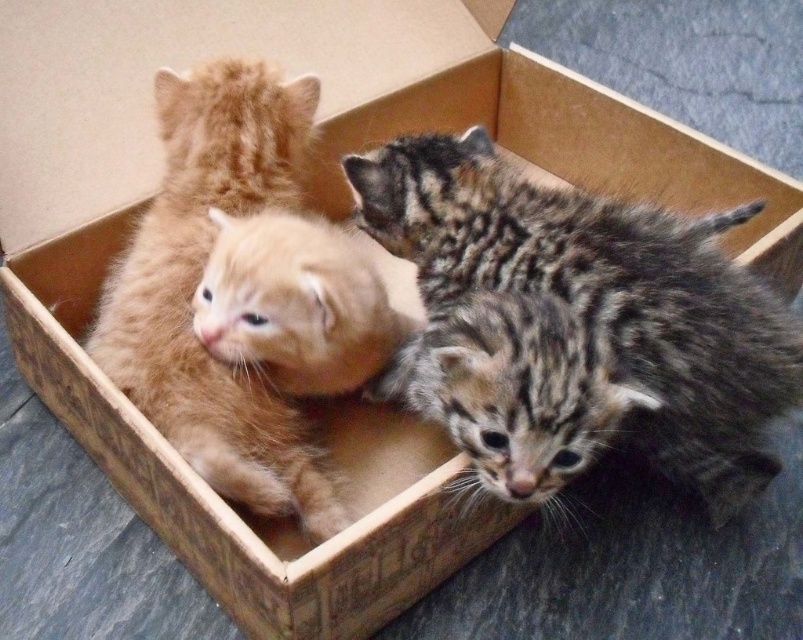
You are a cat owner who wants to ensure both kittens have enough space in the box. Given that the tabby fur kitten at center is wider than the matte orange kitten at center, which kitten requires more space in the box?

The tabby fur kitten at center requires more space in the box because its width surpasses that of the matte orange kitten at center.

You are a cat owner who wants to ensure each kitten has enough space in the cardboard box. Given that the tabby fur kitten at center and the soft orange fur kitten at center are both in the center, which kitten requires more space?

The tabby fur kitten at center requires more space because it is bigger than the soft orange fur kitten at center.

You are a photographer trying to capture a closeup of the tabby fur kitten at center. Based on its 2D coordinates, where should you position your camera relative to the box?

The tabby fur kitten at center is located at coordinates 0.456 on the x axis and 0.751 on the y axis. To capture a closeup, position the camera slightly to the right and above the box to align with these coordinates.